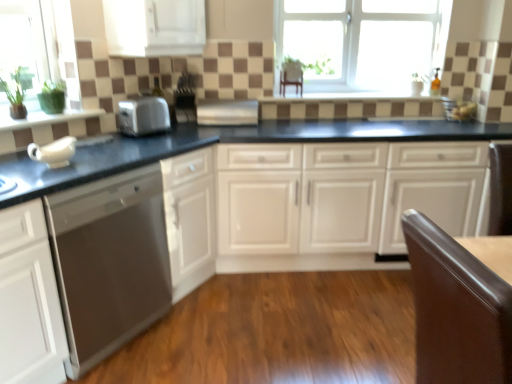
Identify the location of vacant area that is situated to the right of satin stainless steel dishwasher at left. tap(203, 336).